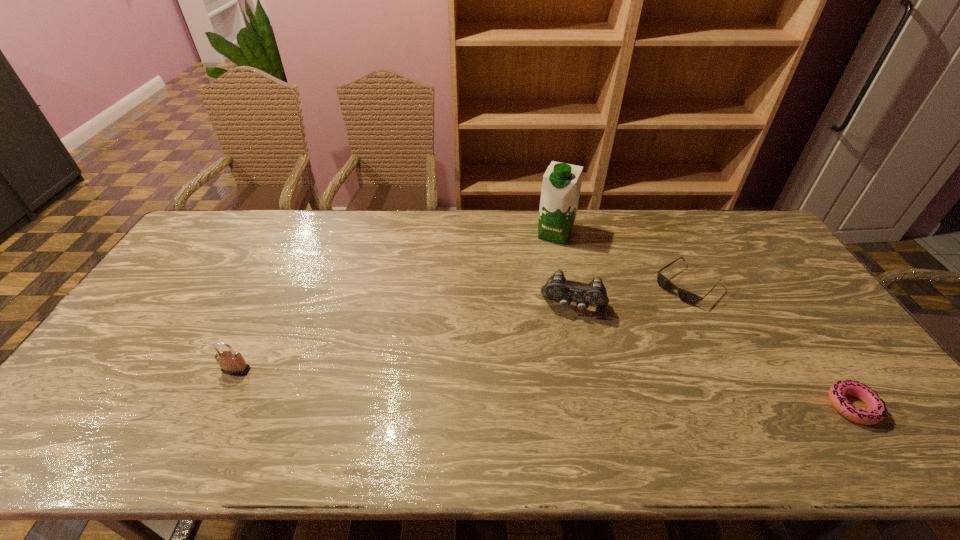
This screenshot has width=960, height=540. In order to click on free space located on the lenses of the second object from right to left in this screenshot , I will do `click(636, 328)`.

Where is `vacant region located on the lenses of the second object from right to left`? vacant region located on the lenses of the second object from right to left is located at coordinates (625, 337).

Where is `blank space located 0.360m on the lenses of the second object from right to left`? The image size is (960, 540). blank space located 0.360m on the lenses of the second object from right to left is located at coordinates (592, 364).

This screenshot has height=540, width=960. Identify the location of free space located on the front-facing side of the farthest object. (526, 300).

Find the location of a particular element. The image size is (960, 540). free location located 0.380m on the front-facing side of the farthest object is located at coordinates (516, 323).

Find the location of a particular element. The width and height of the screenshot is (960, 540). free space located 0.300m on the front-facing side of the farthest object is located at coordinates (524, 305).

This screenshot has height=540, width=960. Identify the location of free location located 0.220m on the surface of the control with buttons. (559, 382).

At what (x,y) coordinates should I click in order to perform the action: click on vacant point located 0.190m on the surface of the control with buttons. Please return your answer as a coordinate pair (x, y). Looking at the image, I should click on (560, 373).

Where is `vacant space located on the surface of the control with buttons`? The width and height of the screenshot is (960, 540). vacant space located on the surface of the control with buttons is located at coordinates (554, 410).

Where is `object that is at the far edge`? object that is at the far edge is located at coordinates (562, 182).